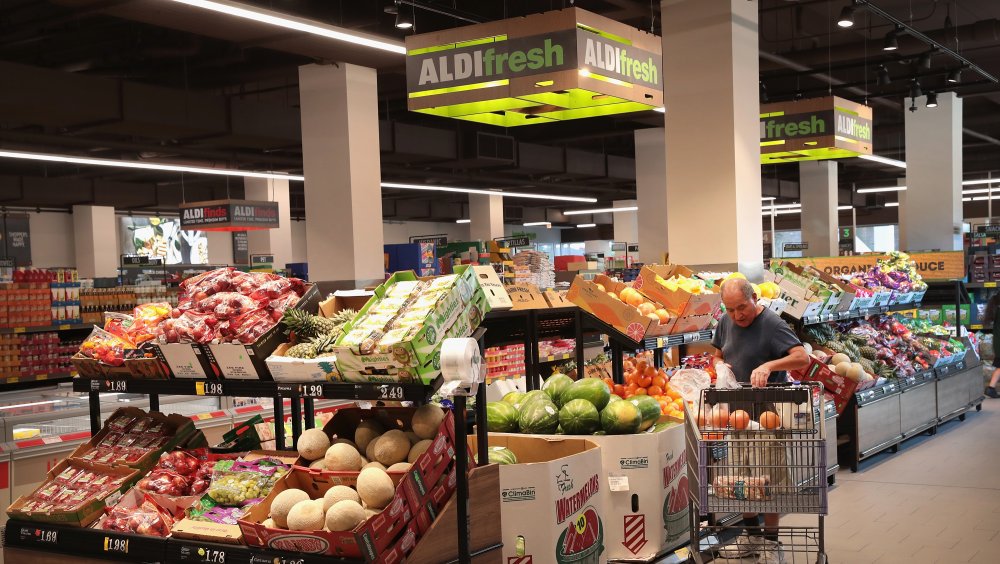
You are a GUI agent. You are given a task and a screenshot of the screen. Output one action in this format:
    pyautogui.click(x=<x>, y=<y>)
    Task: Click on the box
    The image size is (1000, 564).
    Given the screenshot: What is the action you would take?
    pyautogui.click(x=642, y=451), pyautogui.click(x=576, y=482)